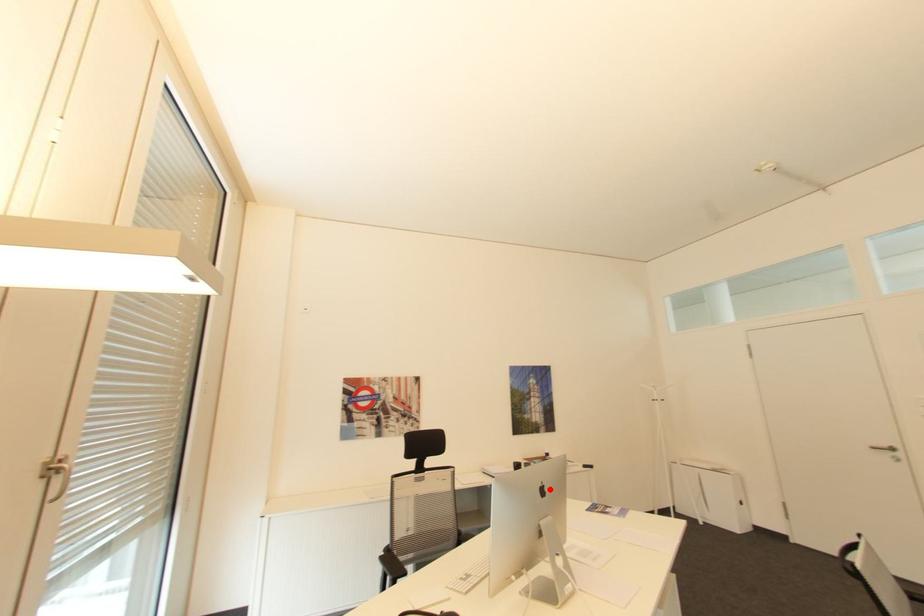
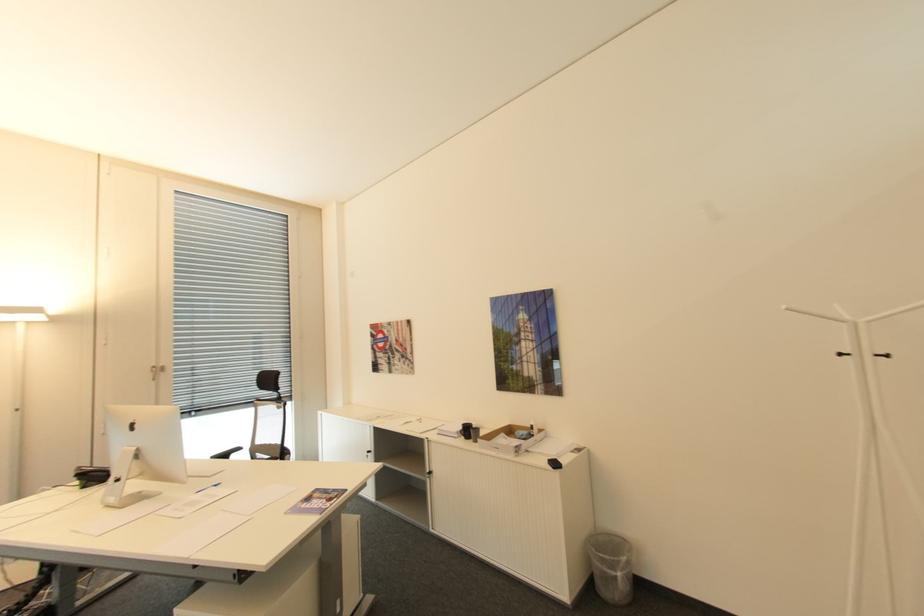
The point at the highlighted location is marked in the first image. Where is the corresponding point in the second image?

(140, 426)